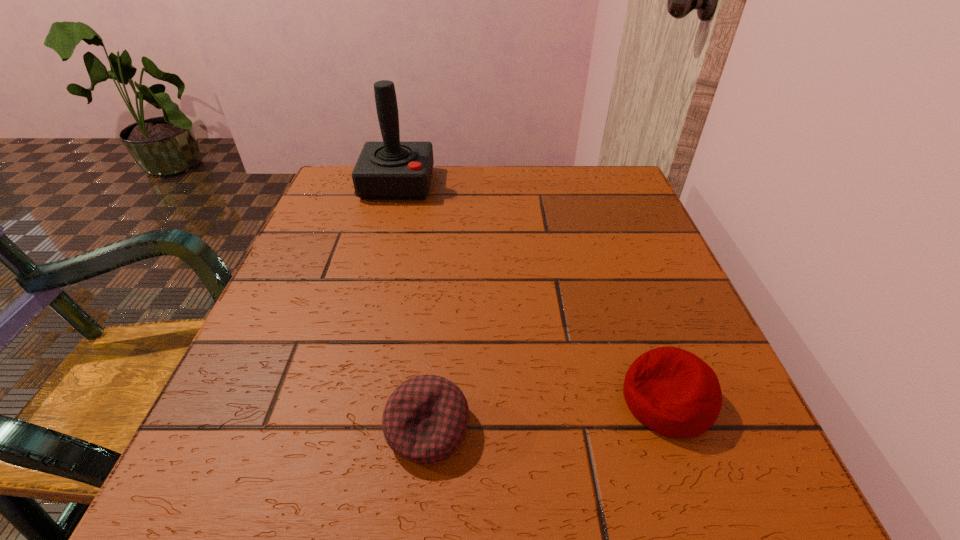
This screenshot has width=960, height=540. In order to click on the farthest object in this screenshot , I will do `click(390, 170)`.

You are a GUI agent. You are given a task and a screenshot of the screen. Output one action in this format:
    pyautogui.click(x=<x>, y=<y>)
    Task: Click on the tallest object
    This screenshot has height=540, width=960.
    Given the screenshot: What is the action you would take?
    pyautogui.click(x=390, y=170)

You are a GUI agent. You are given a task and a screenshot of the screen. Output one action in this format:
    pyautogui.click(x=<x>, y=<y>)
    Task: Click on the rightmost object
    
    Given the screenshot: What is the action you would take?
    pyautogui.click(x=673, y=392)

Locate an element on the screen. The height and width of the screenshot is (540, 960). the left beanbag is located at coordinates (425, 419).

This screenshot has width=960, height=540. I want to click on free point located on the base of the farthest object, so click(370, 285).

I want to click on free space located 0.100m on the seat area of the right beanbag, so click(x=553, y=400).

Where is `vacant space located on the seat area of the right beanbag`? The image size is (960, 540). vacant space located on the seat area of the right beanbag is located at coordinates pos(462,400).

The width and height of the screenshot is (960, 540). I want to click on vacant space located 0.190m on the seat area of the right beanbag, so click(x=490, y=400).

Where is `vacant space located on the back of the left beanbag`? vacant space located on the back of the left beanbag is located at coordinates (441, 292).

You are a GUI agent. You are given a task and a screenshot of the screen. Output one action in this format:
    pyautogui.click(x=<x>, y=<y>)
    Task: Click on the object located in the far edge section of the desktop
    
    Given the screenshot: What is the action you would take?
    pyautogui.click(x=390, y=170)